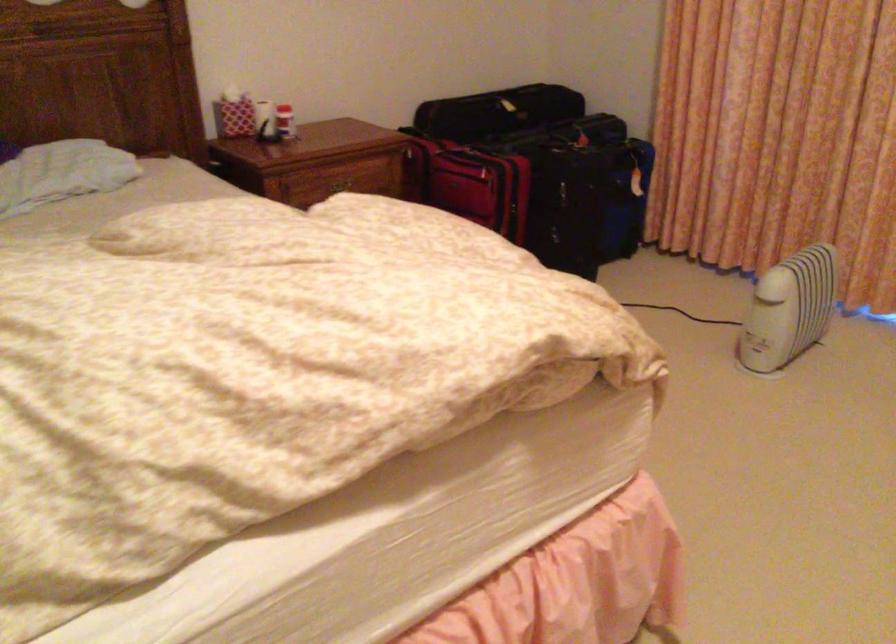
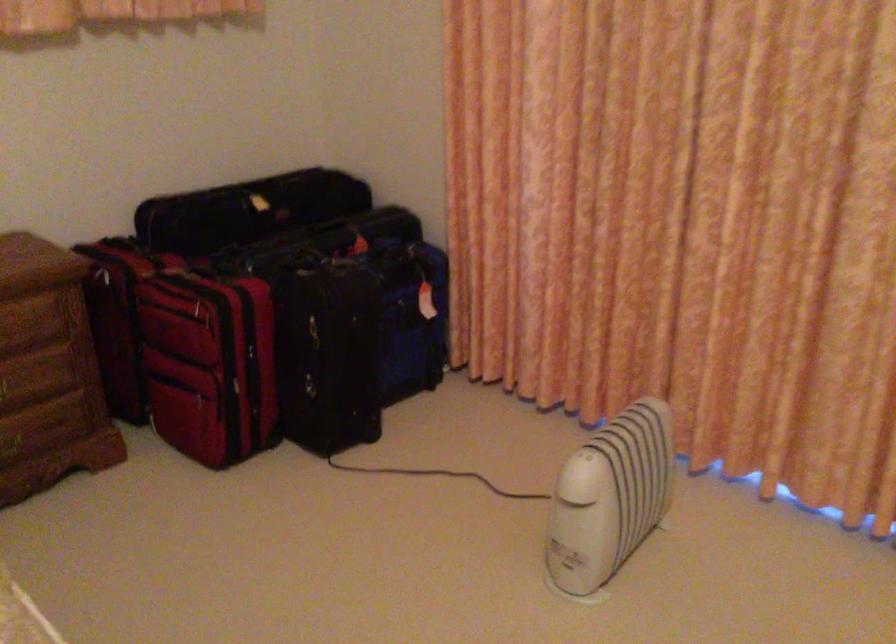
Find the pixel in the second image that matches (x=357, y=178) in the first image.

(14, 319)